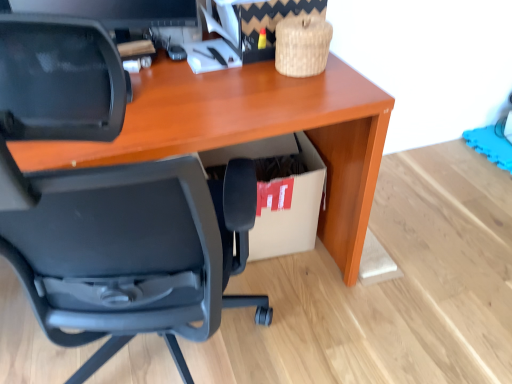
Question: Is cardboard box at lower right situated inside black plastic chair at lower left or outside?

Choices:
 (A) inside
 (B) outside

Answer: (B)

Question: Does point (293, 200) appear closer or farther from the camera than point (9, 246)?

Choices:
 (A) closer
 (B) farther

Answer: (B)

Question: Is cardboard box at lower right bigger or smaller than black plastic chair at lower left?

Choices:
 (A) big
 (B) small

Answer: (B)

Question: From their relative heights in the image, would you say black plastic chair at lower left is taller or shorter than cardboard box at lower right?

Choices:
 (A) short
 (B) tall

Answer: (B)

Question: From a real-world perspective, relative to cardboard box at lower right, is black plastic chair at lower left vertically above or below?

Choices:
 (A) above
 (B) below

Answer: (A)

Question: Considering the positions of black plastic chair at lower left and cardboard box at lower right in the image, is black plastic chair at lower left wider or thinner than cardboard box at lower right?

Choices:
 (A) wide
 (B) thin

Answer: (A)

Question: Is black plastic chair at lower left to the left or to the right of cardboard box at lower right in the image?

Choices:
 (A) right
 (B) left

Answer: (B)